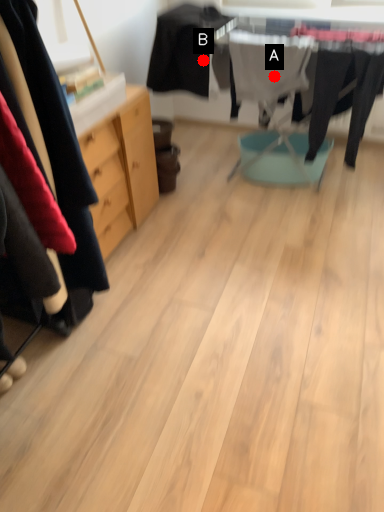
Question: Two points are circled on the image, labeled by A and B beside each circle. Which point is closer to the camera?

Choices:
 (A) A is closer
 (B) B is closer

Answer: (A)